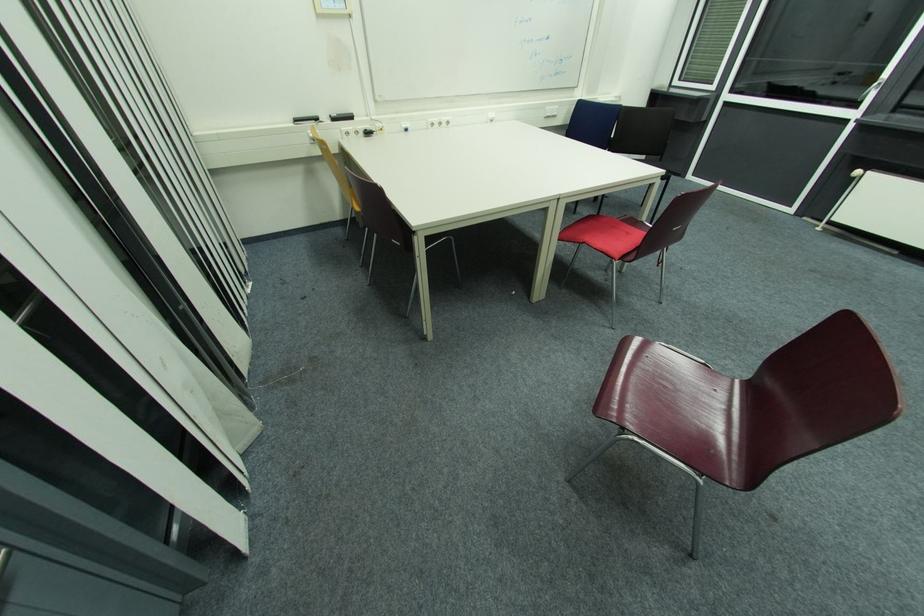
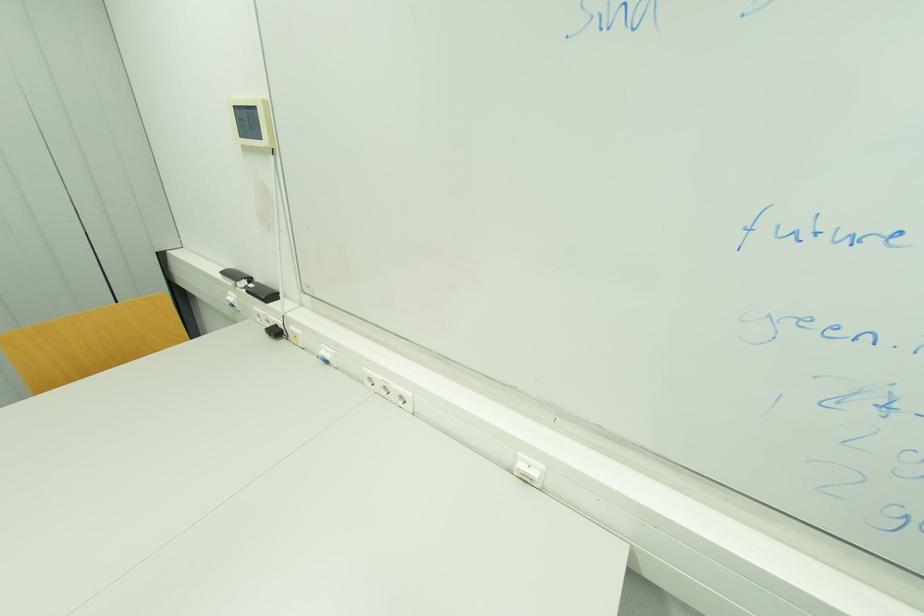
Where in the second image is the point corresponding to point 409,131 from the first image?

(330, 362)